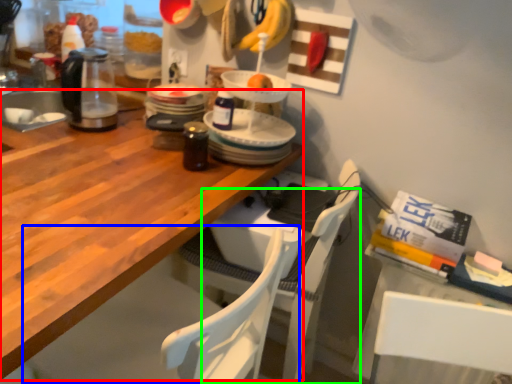
Question: Which object is the farthest from desk (highlighted by a red box)? Choose among these: chair (highlighted by a blue box) or chair (highlighted by a green box).

Choices:
 (A) chair
 (B) chair

Answer: (B)